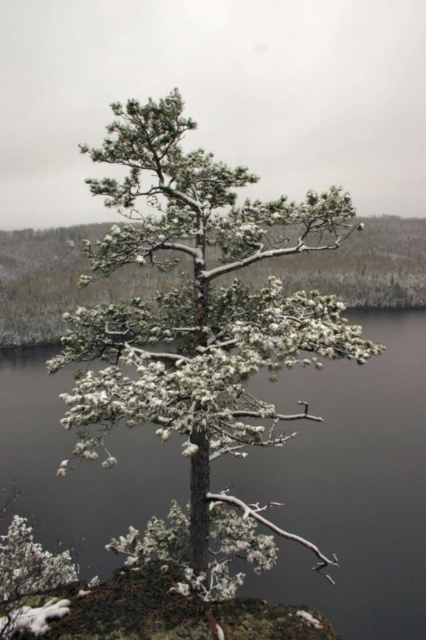
Question: Does snow-covered pine tree at center come in front of transparent water at center?

Choices:
 (A) yes
 (B) no

Answer: (A)

Question: Among these objects, which one is nearest to the camera?

Choices:
 (A) snow-covered pine tree at center
 (B) transparent water at center

Answer: (A)

Question: From the image, what is the correct spatial relationship of snow-covered pine tree at center in relation to transparent water at center?

Choices:
 (A) below
 (B) above

Answer: (B)

Question: Which object is farther from the camera taking this photo?

Choices:
 (A) transparent water at center
 (B) snow-covered pine tree at center

Answer: (A)

Question: Can you confirm if snow-covered pine tree at center is smaller than transparent water at center?

Choices:
 (A) yes
 (B) no

Answer: (B)

Question: Which point is farther to the camera?

Choices:
 (A) transparent water at center
 (B) snow-covered pine tree at center

Answer: (A)